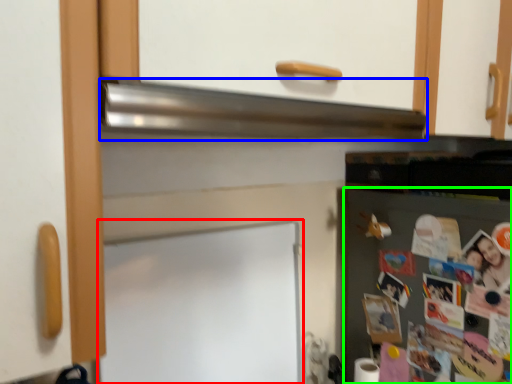
Question: Which is farther away from bulletin board (highlighted by a red box)? exhaust hood (highlighted by a blue box) or fridge (highlighted by a green box)?

Choices:
 (A) exhaust hood
 (B) fridge

Answer: (B)